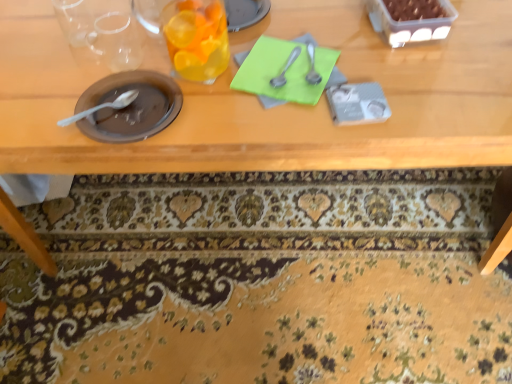
Question: Is green paper at center oriented away from wooden table at center?

Choices:
 (A) no
 (B) yes

Answer: (B)

Question: Is green paper at center behind wooden table at center?

Choices:
 (A) yes
 (B) no

Answer: (A)

Question: Considering the relative sizes of green paper at center and wooden table at center in the image provided, is green paper at center thinner than wooden table at center?

Choices:
 (A) no
 (B) yes

Answer: (B)

Question: Is green paper at center smaller than wooden table at center?

Choices:
 (A) yes
 (B) no

Answer: (A)

Question: Would you say wooden table at center is part of green paper at center's contents?

Choices:
 (A) no
 (B) yes

Answer: (A)

Question: Is wooden table at center inside the boundaries of matte brown plate at left, the fourth tableware viewed from the right, or outside?

Choices:
 (A) outside
 (B) inside

Answer: (A)

Question: From a real-world perspective, is wooden table at center physically located above or below matte brown plate at left, the first tableware viewed from the left?

Choices:
 (A) below
 (B) above

Answer: (A)

Question: From the image's perspective, is wooden table at center above or below matte brown plate at left, the first tableware viewed from the left?

Choices:
 (A) below
 (B) above

Answer: (A)

Question: Based on their sizes in the image, would you say wooden table at center is bigger or smaller than matte brown plate at left, the first tableware viewed from the left?

Choices:
 (A) small
 (B) big

Answer: (B)

Question: From a real-world perspective, relative to wooden table at center, is satin silver spoon at upper center, the 4th tableware when ordered from left to right, vertically above or below?

Choices:
 (A) above
 (B) below

Answer: (A)

Question: Is point (313, 54) positioned closer to the camera than point (227, 96)?

Choices:
 (A) farther
 (B) closer

Answer: (A)

Question: From the image's perspective, is satin silver spoon at upper center, the 4th tableware when ordered from left to right, located above or below wooden table at center?

Choices:
 (A) below
 (B) above

Answer: (B)

Question: Looking at their shapes, would you say satin silver spoon at upper center, the first tableware in the right-to-left sequence, is wider or thinner than wooden table at center?

Choices:
 (A) wide
 (B) thin

Answer: (B)

Question: From the image's perspective, is matte brown plate at left, the fourth tableware viewed from the right, above or below translucent glass at upper center, the second tableware when ordered from left to right?

Choices:
 (A) above
 (B) below

Answer: (B)

Question: Relative to translucent glass at upper center, which is the 3th tableware from right to left, is matte brown plate at left, the fourth tableware viewed from the right, in front or behind?

Choices:
 (A) front
 (B) behind

Answer: (B)